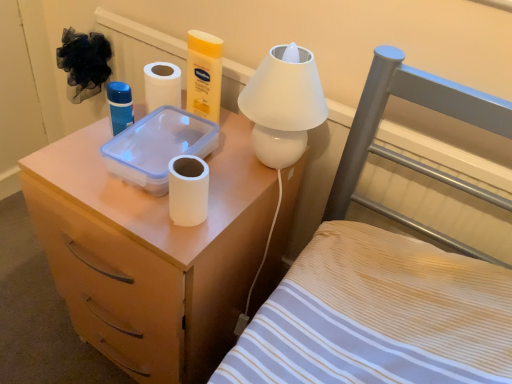
Find the location of `vacant space to the left of white matte toilet paper at center`. vacant space to the left of white matte toilet paper at center is located at coordinates (113, 196).